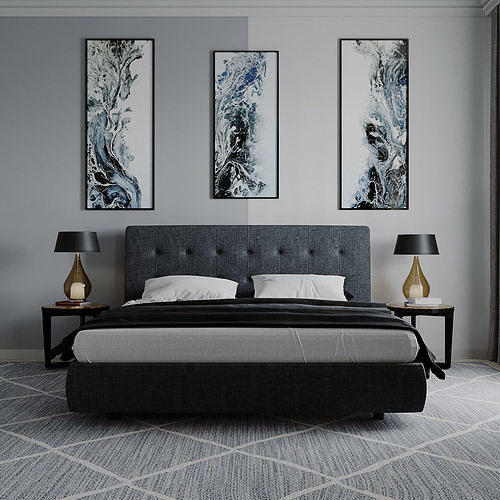
Where is `blanket`? blanket is located at coordinates (252, 311).